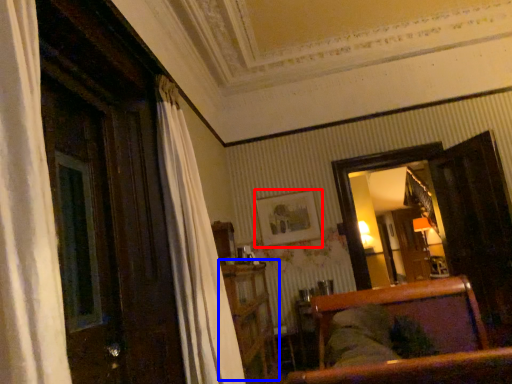
Question: Which object is closer to the camera taking this photo, picture frame (highlighted by a red box) or dresser (highlighted by a blue box)?

Choices:
 (A) picture frame
 (B) dresser

Answer: (B)